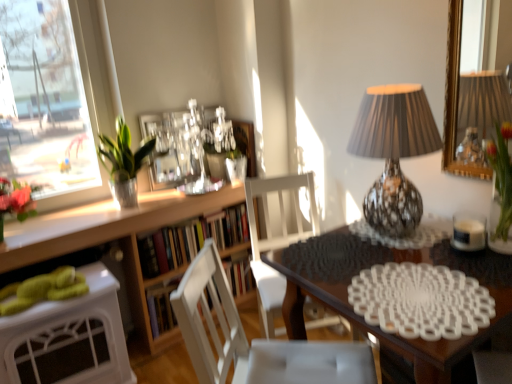
Question: Is white wood chair at center, the 2th chair from the back, shorter than white matte chair at center, arranged as the 1th chair when viewed from the back?

Choices:
 (A) yes
 (B) no

Answer: (A)

Question: Does white wood chair at center, the 2th chair from the back, have a greater height compared to white matte chair at center, the 2th chair in the front-to-back sequence?

Choices:
 (A) yes
 (B) no

Answer: (B)

Question: Can you confirm if white wood chair at center, the 2th chair from the back, is positioned to the left of white matte chair at center, arranged as the 1th chair when viewed from the back?

Choices:
 (A) no
 (B) yes

Answer: (B)

Question: Does white wood chair at center, arranged as the 1th chair when viewed from the front, have a lesser width compared to white matte chair at center, arranged as the 1th chair when viewed from the back?

Choices:
 (A) yes
 (B) no

Answer: (B)

Question: From a real-world perspective, does white wood chair at center, arranged as the 1th chair when viewed from the front, sit lower than white matte chair at center, the 2th chair in the front-to-back sequence?

Choices:
 (A) no
 (B) yes

Answer: (A)

Question: From the image's perspective, is white wood chair at center, the 2th chair from the back, beneath white matte chair at center, arranged as the 1th chair when viewed from the back?

Choices:
 (A) no
 (B) yes

Answer: (B)

Question: Is white wood chair at center, arranged as the 1th chair when viewed from the front, smaller than green leafy plant in glass vase at upper left?

Choices:
 (A) yes
 (B) no

Answer: (B)

Question: Is white wood chair at center, the 2th chair from the back, taller than green leafy plant in glass vase at upper left?

Choices:
 (A) no
 (B) yes

Answer: (B)

Question: From a real-world perspective, is white wood chair at center, arranged as the 1th chair when viewed from the front, located beneath green leafy plant in glass vase at upper left?

Choices:
 (A) yes
 (B) no

Answer: (A)

Question: Could you tell me if white wood chair at center, arranged as the 1th chair when viewed from the front, is turned towards green leafy plant in glass vase at upper left?

Choices:
 (A) no
 (B) yes

Answer: (A)

Question: From a real-world perspective, is white wood chair at center, arranged as the 1th chair when viewed from the front, on top of green leafy plant in glass vase at upper left?

Choices:
 (A) yes
 (B) no

Answer: (B)

Question: Considering the relative positions of white wood chair at center, arranged as the 1th chair when viewed from the front, and green leafy plant in glass vase at upper left in the image provided, is white wood chair at center, arranged as the 1th chair when viewed from the front, to the right of green leafy plant in glass vase at upper left from the viewer's perspective?

Choices:
 (A) yes
 (B) no

Answer: (A)

Question: Can white glossy desk at lower left be found inside clear glass picture frame at upper center?

Choices:
 (A) yes
 (B) no

Answer: (B)